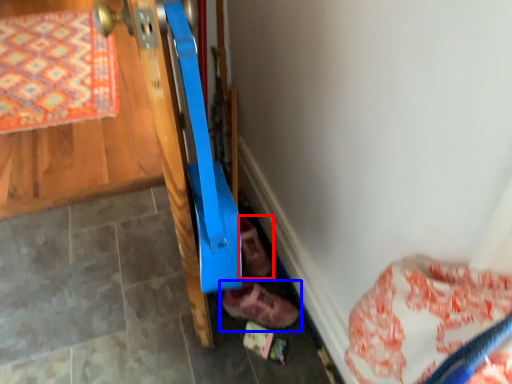
Question: Among these objects, which one is farthest to the camera, footwear (highlighted by a red box) or footwear (highlighted by a blue box)?

Choices:
 (A) footwear
 (B) footwear

Answer: (A)